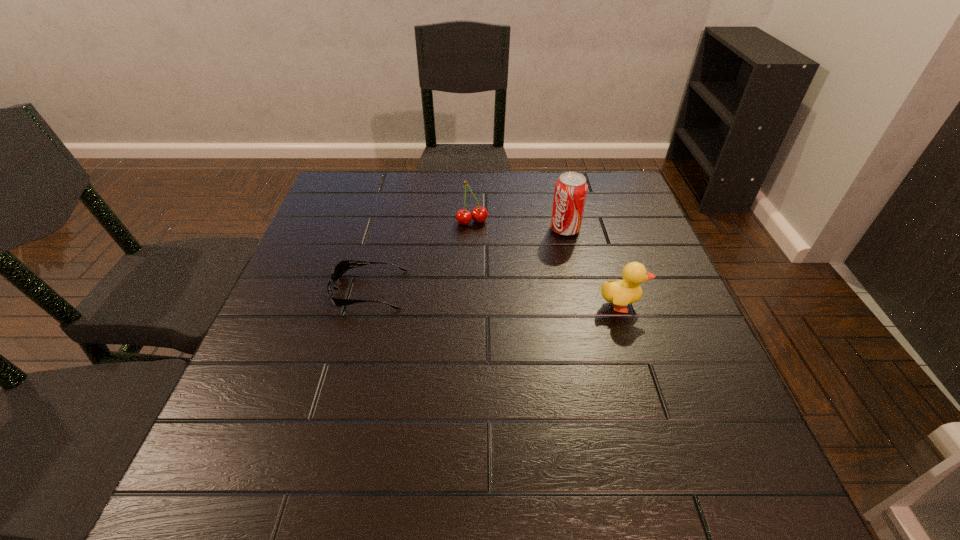
I want to click on free space located 0.360m on the logo side of the tallest object, so click(x=456, y=305).

Where is `vacant space located on the logo side of the tallest object`? This screenshot has height=540, width=960. vacant space located on the logo side of the tallest object is located at coordinates (484, 286).

This screenshot has height=540, width=960. In order to click on object that is at the left edge in this screenshot , I will do `click(343, 266)`.

Where is `object present at the right edge`? This screenshot has width=960, height=540. object present at the right edge is located at coordinates (620, 293).

The image size is (960, 540). I want to click on vacant space at the far edge, so click(x=455, y=211).

This screenshot has height=540, width=960. Identify the location of vacant space at the left edge of the desktop. (348, 242).

Where is `vacant space at the right edge of the desktop`? vacant space at the right edge of the desktop is located at coordinates [636, 219].

This screenshot has height=540, width=960. Identify the location of free space at the far left corner. (343, 174).

You are a GUI agent. You are given a task and a screenshot of the screen. Output one action in this format:
    pyautogui.click(x=<x>, y=<y>)
    Task: Click on the free space at the near left corner
    This screenshot has height=540, width=960.
    Given the screenshot: What is the action you would take?
    pyautogui.click(x=242, y=410)

Locate an element on the screen. free region at the far right corner is located at coordinates (611, 173).